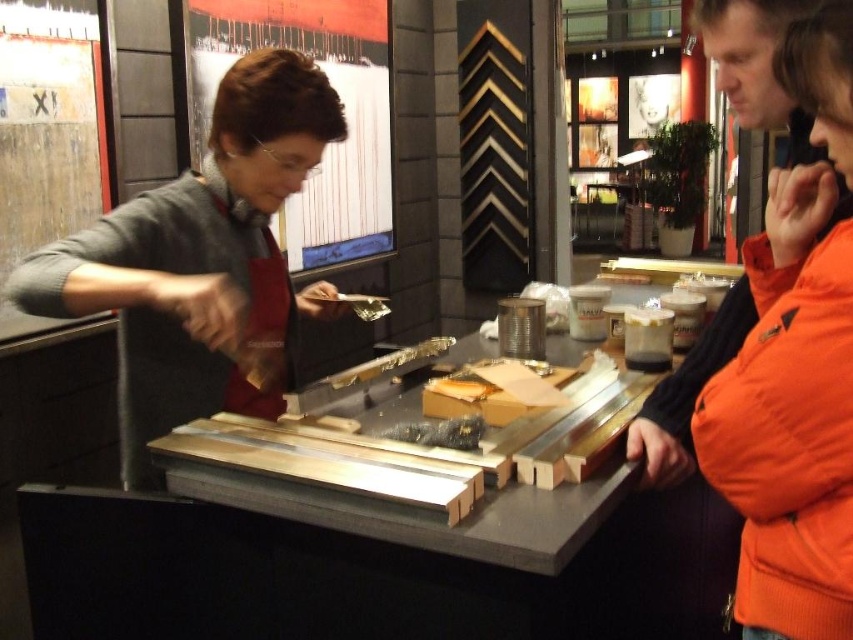
You are a visitor in the art gallery and see both the matte gray sweater at center and the yellowish matte cheese at center on the table. Which object is closer to you?

The matte gray sweater at center is closer to you because it is in front of the yellowish matte cheese at center.

You are standing in the art gallery and see two points on the table where the craft demonstration is happening. The first point is at coordinate (782, 342) and the second is at (479, 387). From your perspective, which point is closer to you?

Point (782, 342) is in front of point (479, 387), so it is closer to you.